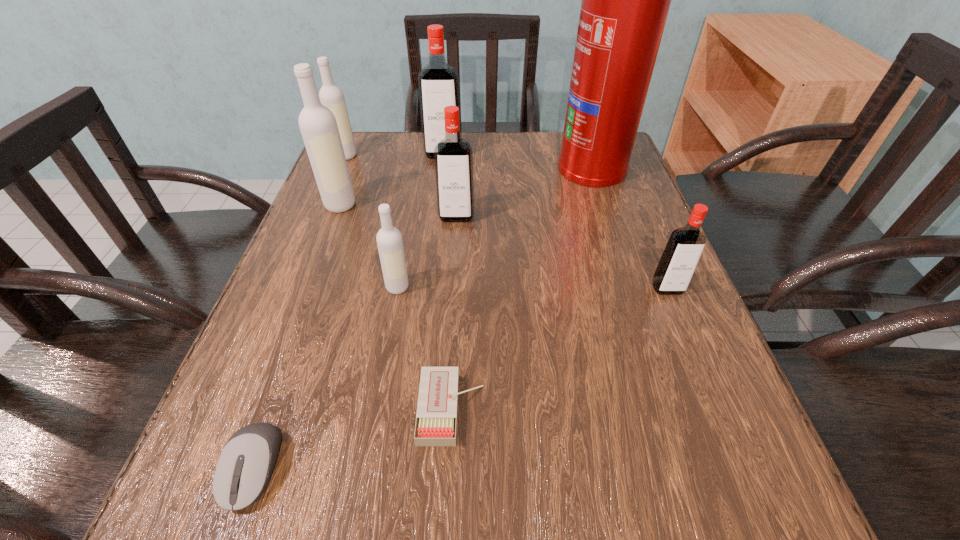
Locate an element on the screen. The image size is (960, 540). the eighth tallest object is located at coordinates (244, 468).

What are the coordinates of `white matchbox` in the screenshot? It's located at (436, 419).

You are a GUI agent. You are given a task and a screenshot of the screen. Output one action in this format:
    pyautogui.click(x=<x>, y=<y>)
    Task: Click on the shortest object
    This screenshot has height=540, width=960.
    Given the screenshot: What is the action you would take?
    click(x=436, y=419)

Find the location of a particular element. This screenshot has height=540, width=960. free spot located on the instruction side of the fire extinguisher is located at coordinates click(x=396, y=166).

Identify the location of vacant space situated 0.370m on the instruction side of the fire extinguisher. (408, 166).

The image size is (960, 540). In order to click on vacant space located 0.080m on the instruction side of the fire extinguisher in this screenshot , I will do `click(525, 166)`.

This screenshot has width=960, height=540. Find the location of `vacant space located on the back of the biggest white vodka`. vacant space located on the back of the biggest white vodka is located at coordinates (348, 184).

Where is `vacant space located on the front and back of the farthest red vodka`? This screenshot has width=960, height=540. vacant space located on the front and back of the farthest red vodka is located at coordinates (439, 192).

Image resolution: width=960 pixels, height=540 pixels. In order to click on vacant space located 0.050m on the right of the farthest white vodka in this screenshot , I will do `click(376, 156)`.

Image resolution: width=960 pixels, height=540 pixels. I want to click on free space located 0.400m on the front and back of the second farthest red vodka, so click(x=445, y=392).